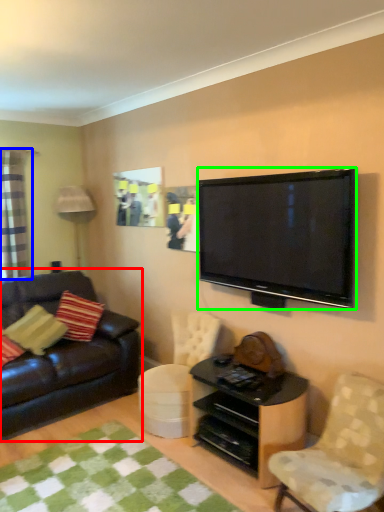
Question: Considering the real-world distances, which object is farthest from studio couch (highlighted by a red box)? curtain (highlighted by a blue box) or television (highlighted by a green box)?

Choices:
 (A) curtain
 (B) television

Answer: (B)